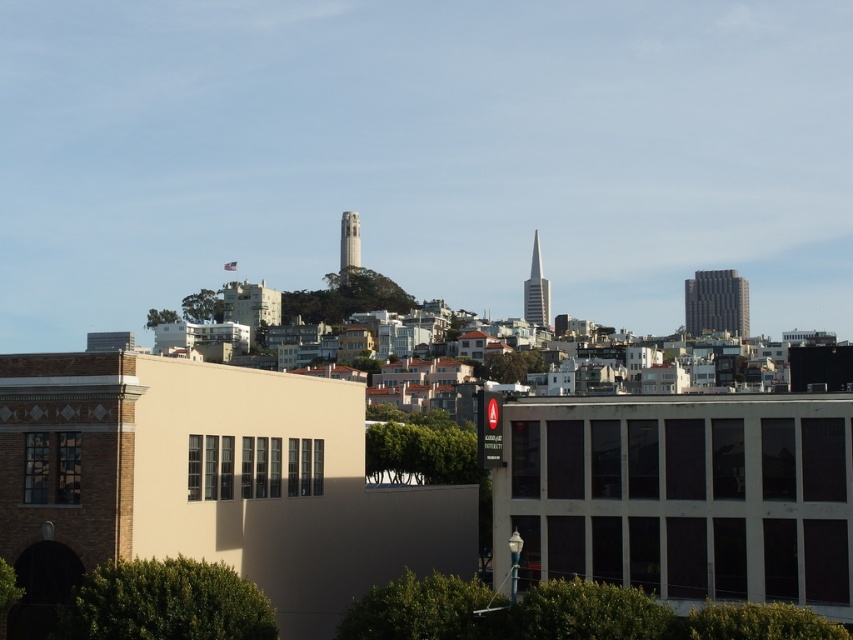
You are an urban planner reviewing the city layout. You need to determine the spatial relationship between the dark gray textured building at right and the smooth concrete tower at center. Which one is positioned lower in the scene?

The dark gray textured building at right is located below the smooth concrete tower at center, so it is positioned lower in the scene.

You are a city planner analyzing the layout of this area. You need to determine if the dark gray textured building at right has a greater width than the smooth concrete tower at center. Based on the available information, what can you conclude?

The dark gray textured building at right might be wider than smooth concrete tower at center according to the description provided.

You are a drone operator tasked with flying a drone between the dark gray textured building at right and the shiny glass skyscraper at center. The drone has a minimum safe distance requirement of 50 meters to avoid collision. Based on the scene description, can the drone safely fly between them?

The dark gray textured building at right is 41.66 meters away from the shiny glass skyscraper at center. Since the minimum safe distance required is 50 meters, the drone cannot safely fly between them as the distance is insufficient.